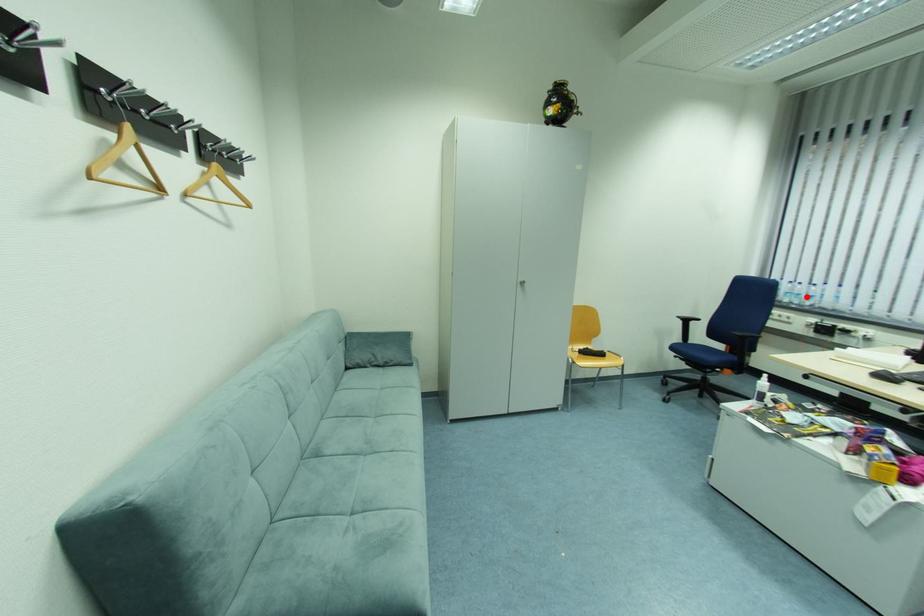
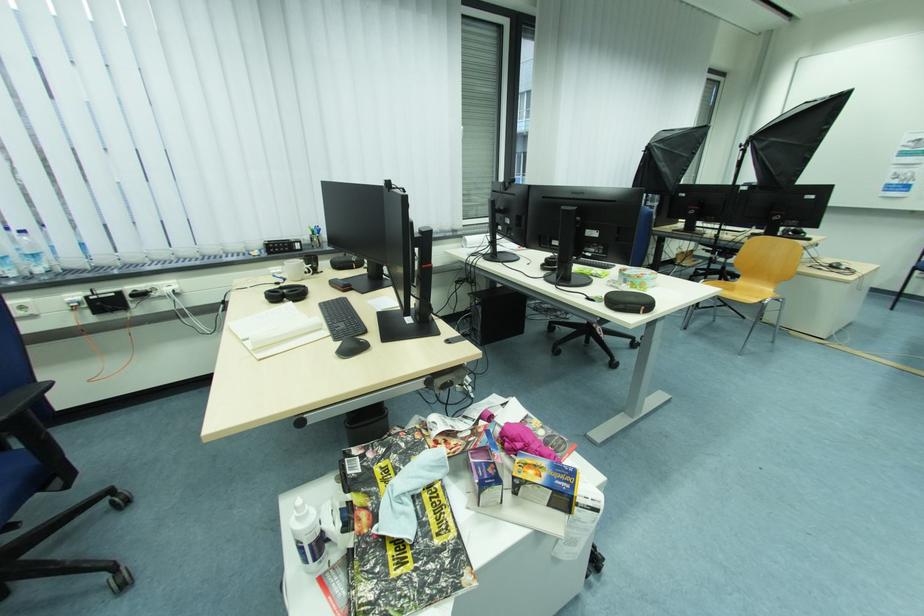
Question: A red point is marked in image1. In image2, is the corresponding 3D point closer to the camera or farther? Reply with the corresponding letter.

Choices:
 (A) The corresponding 3D point is closer.
 (B) The corresponding 3D point is farther.

Answer: (B)